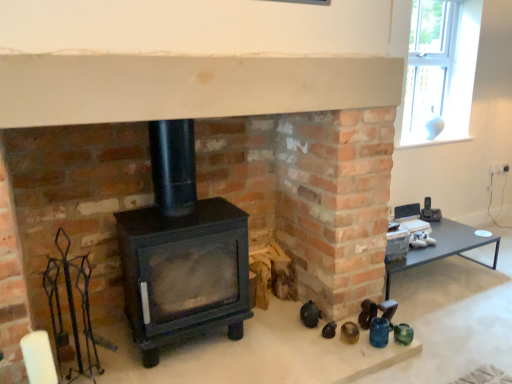
Question: Is white glass vase at upper right inside the boundaries of black matte wood burning stove at center, or outside?

Choices:
 (A) inside
 (B) outside

Answer: (B)

Question: Looking at their shapes, would you say white glass vase at upper right is wider or thinner than black matte wood burning stove at center?

Choices:
 (A) wide
 (B) thin

Answer: (B)

Question: Which object is the farthest from the matte black table at right?

Choices:
 (A) white glass vase at upper right
 (B) black matte wood burning stove at center

Answer: (B)

Question: Estimate the real-world distances between objects in this image. Which object is farther from the white glass vase at upper right?

Choices:
 (A) matte black table at right
 (B) black matte wood burning stove at center

Answer: (B)